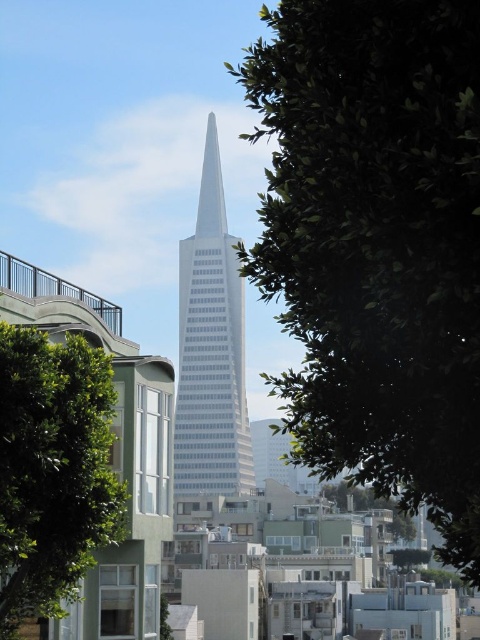
You are an architect analyzing the city layout. You observe the green leafy tree at center and the white glass skyscraper at center. Which object is positioned higher in the image?

The green leafy tree at center is located above the white glass skyscraper at center, so it is positioned higher in the image.